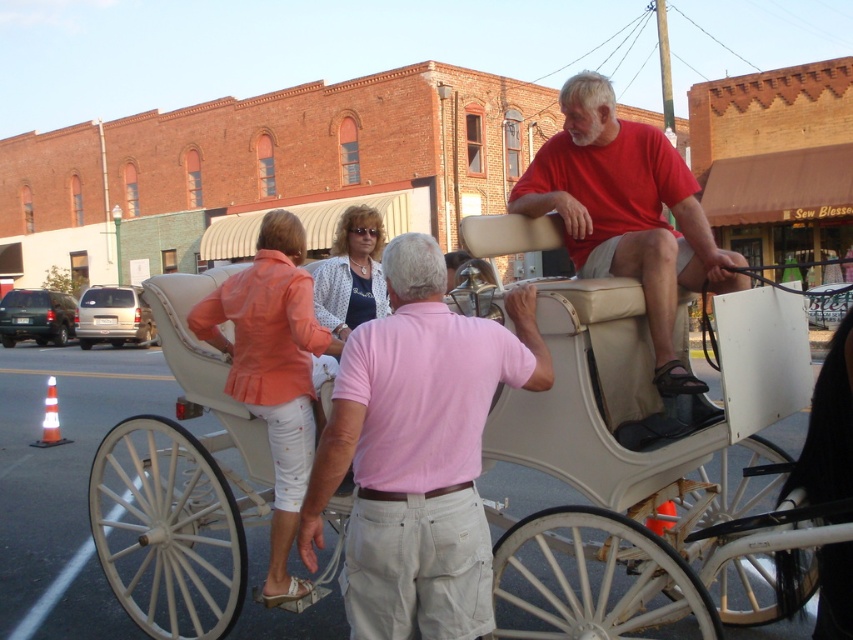
Question: Which point appears closest to the camera in this image?

Choices:
 (A) (434, 304)
 (B) (636, 268)

Answer: (A)

Question: Does pink cotton shirt at center lie behind matte red shirt at center?

Choices:
 (A) yes
 (B) no

Answer: (B)

Question: Does white leather horse cart at center appear on the right side of matte red shirt at center?

Choices:
 (A) no
 (B) yes

Answer: (A)

Question: Which object is the closest to the polka dot blouse at center?

Choices:
 (A) orange fabric blouse at center
 (B) matte red shirt at center
 (C) white leather horse cart at center
 (D) pink cotton shirt at center

Answer: (A)

Question: Does pink cotton shirt at center appear on the right side of orange fabric blouse at center?

Choices:
 (A) no
 (B) yes

Answer: (B)

Question: Which point is closer to the camera taking this photo?

Choices:
 (A) (662, 234)
 (B) (407, 600)
 (C) (706, 490)

Answer: (B)